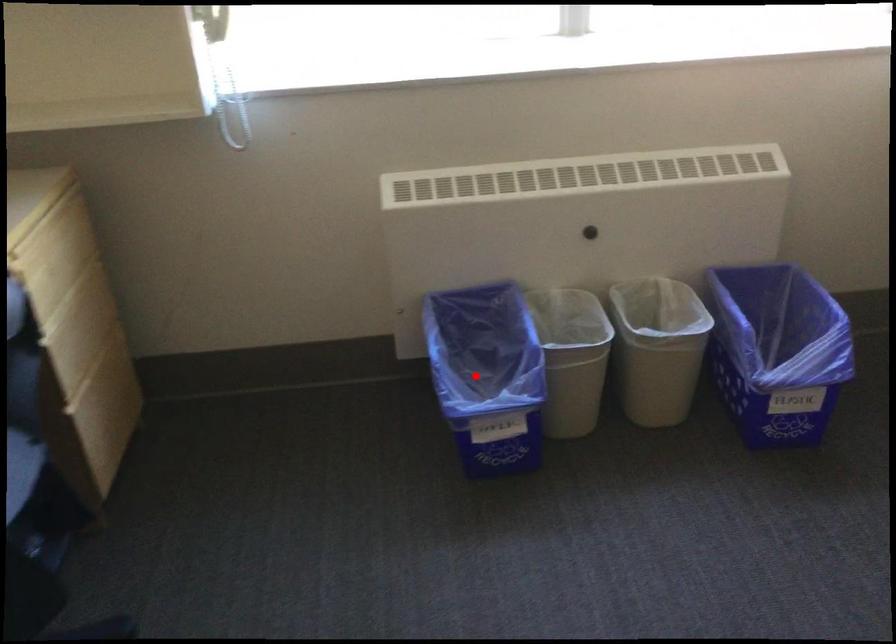
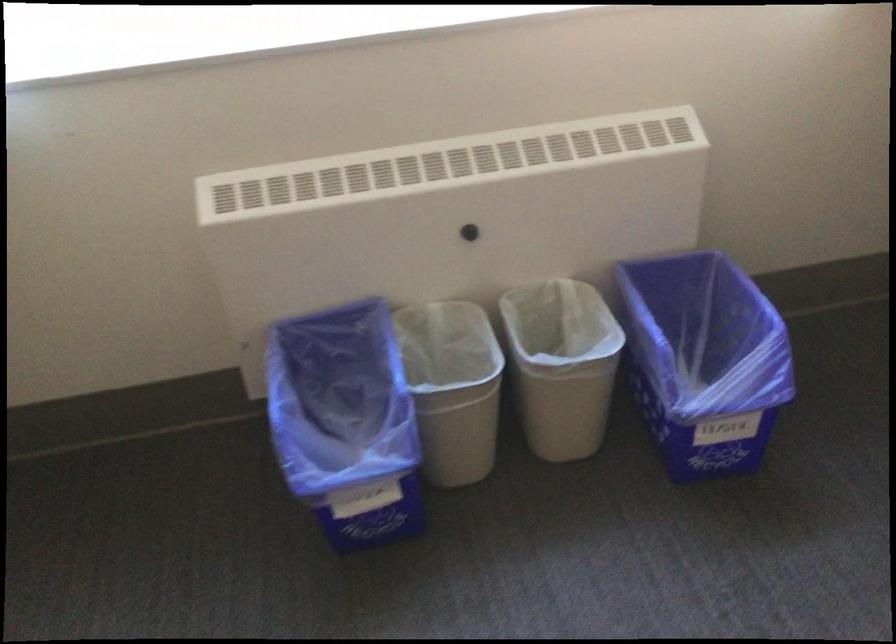
Question: I am providing you with two images of the same scene from different viewpoints. Given a red point in image1, look at the same physical point in image2. Is it:

Choices:
 (A) Closer to the viewpoint
 (B) Farther from the viewpoint

Answer: (A)